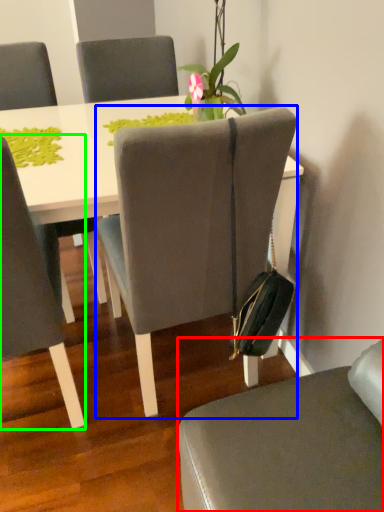
Question: Which object is positioned closest to chair (highlighted by a red box)? Select from chair (highlighted by a blue box) and chair (highlighted by a green box).

Choices:
 (A) chair
 (B) chair

Answer: (A)